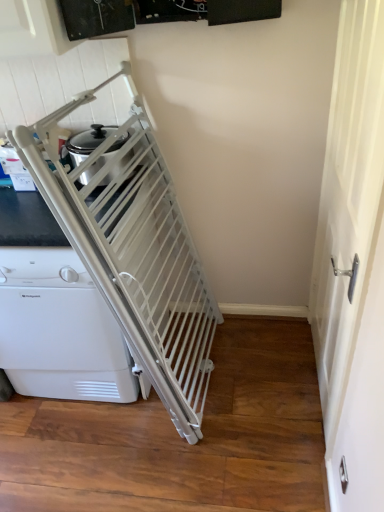
Where is `white plastic gate at left`? The width and height of the screenshot is (384, 512). white plastic gate at left is located at coordinates (60, 330).

What do you see at coordinates (60, 330) in the screenshot?
I see `white plastic gate at left` at bounding box center [60, 330].

Identify the location of white matte screen door at right. (348, 200).

This screenshot has height=512, width=384. Describe the element at coordinates (348, 200) in the screenshot. I see `white matte screen door at right` at that location.

Locate an element on the screen. Image resolution: width=384 pixels, height=512 pixels. white plastic gate at left is located at coordinates (60, 330).

In the image, is white plastic gate at left on the left side or the right side of white matte screen door at right?

Clearly, white plastic gate at left is on the left of white matte screen door at right in the image.

Relative to white matte screen door at right, is white plastic gate at left in front or behind?

In the image, white plastic gate at left appears behind white matte screen door at right.

Does point (84, 325) appear closer or farther from the camera than point (331, 113)?

Point (84, 325).

From the image's perspective, is white plastic gate at left over white matte screen door at right?

No, from the image's perspective, white plastic gate at left is not on top of white matte screen door at right.

From a real-world perspective, which object stands above the other?

white matte screen door at right is physically above.

Which object is thinner, white plastic gate at left or white matte screen door at right?

white matte screen door at right is thinner.

Does white plastic gate at left have a lesser height compared to white matte screen door at right?

Indeed, white plastic gate at left has a lesser height compared to white matte screen door at right.

Who is smaller, white plastic gate at left or white matte screen door at right?

With smaller size is white matte screen door at right.

Is white matte screen door at right a part of white plastic gate at left?

That's incorrect, white matte screen door at right is not inside white plastic gate at left.

Is white plastic gate at left touching white matte screen door at right?

No, white plastic gate at left is not touching white matte screen door at right.

Is white plastic gate at left aimed at white matte screen door at right?

No, white plastic gate at left is not oriented towards white matte screen door at right.

In order to click on home appliance that is behind the white matte screen door at right in this screenshot , I will do coord(60,330).

Between white matte screen door at right and white plastic gate at left, which one appears on the right side from the viewer's perspective?

white matte screen door at right.

Relative to white plastic gate at left, is white matte screen door at right in front or behind?

white matte screen door at right is positioned closer to the viewer than white plastic gate at left.

Is point (334, 134) in front of point (72, 305)?

No.

From the picture: From the image's perspective, which object appears higher, white matte screen door at right or white plastic gate at left?

white matte screen door at right.

From a real-world perspective, does white matte screen door at right stand above white plastic gate at left?

Yes, from a real-world perspective, white matte screen door at right is above white plastic gate at left.

Between white matte screen door at right and white plastic gate at left, which one has larger width?

Wider between the two is white plastic gate at left.

Considering the relative sizes of white matte screen door at right and white plastic gate at left in the image provided, is white matte screen door at right taller than white plastic gate at left?

Indeed, white matte screen door at right has a greater height compared to white plastic gate at left.

Is white matte screen door at right smaller than white plastic gate at left?

Correct, white matte screen door at right occupies less space than white plastic gate at left.

Is white plastic gate at left inside white matte screen door at right?

Definitely not — white plastic gate at left is not inside white matte screen door at right.

Is there a large distance between white matte screen door at right and white plastic gate at left?

Yes.

Is white matte screen door at right positioned with its back to white plastic gate at left?

white matte screen door at right is not turned away from white plastic gate at left.

Locate an element on the screen. This screenshot has height=512, width=384. home appliance beneath the white matte screen door at right (from a real-world perspective) is located at coordinates (60, 330).

In order to click on home appliance to the left of white matte screen door at right in this screenshot , I will do `click(60, 330)`.

Locate an element on the screen. screen door above the white plastic gate at left (from the image's perspective) is located at coordinates (348, 200).